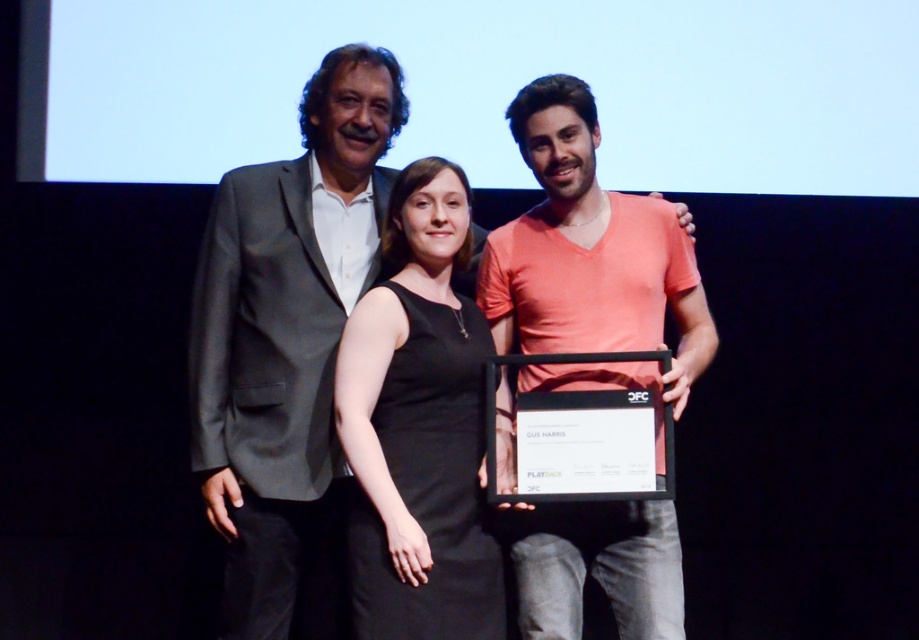
Question: Among these points, which one is farthest from the camera?

Choices:
 (A) pyautogui.click(x=540, y=541)
 (B) pyautogui.click(x=395, y=182)

Answer: (B)

Question: Is matte gray suit at center above black dress at center?

Choices:
 (A) no
 (B) yes

Answer: (A)

Question: Estimate the real-world distances between objects in this image. Which object is closer to the matte gray suit at center?

Choices:
 (A) matte orange t-shirt at center
 (B) black dress at center

Answer: (B)

Question: Is matte orange t-shirt at center thinner than black dress at center?

Choices:
 (A) yes
 (B) no

Answer: (B)

Question: Is matte gray suit at center bigger than black dress at center?

Choices:
 (A) no
 (B) yes

Answer: (B)

Question: Which object appears closest to the camera in this image?

Choices:
 (A) black dress at center
 (B) matte gray suit at center

Answer: (A)